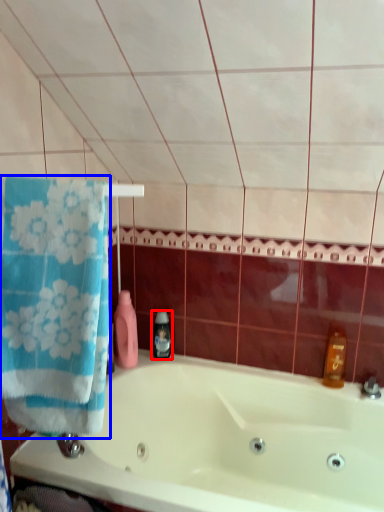
Question: Which object appears closest to the camera in this image, soap dispenser (highlighted by a red box) or towel (highlighted by a blue box)?

Choices:
 (A) soap dispenser
 (B) towel

Answer: (B)